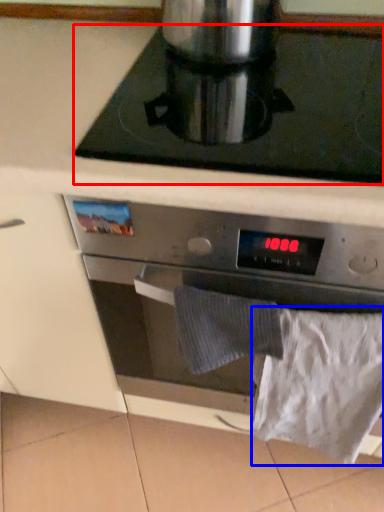
Question: Which of the following is the closest to the observer, gas stove (highlighted by a red box) or sheet (highlighted by a blue box)?

Choices:
 (A) gas stove
 (B) sheet

Answer: (A)